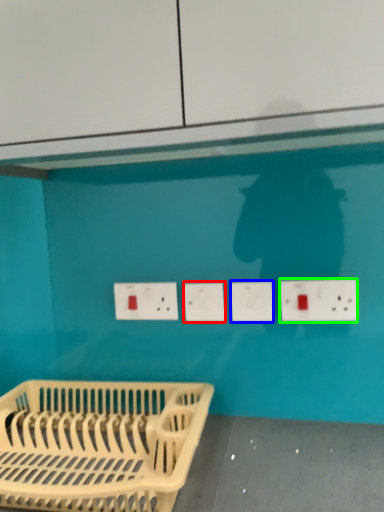
Question: Which object is the farthest from socket (highlighted by a red box)? Choose among these: socket (highlighted by a blue box) or electric outlet (highlighted by a green box).

Choices:
 (A) socket
 (B) electric outlet

Answer: (B)